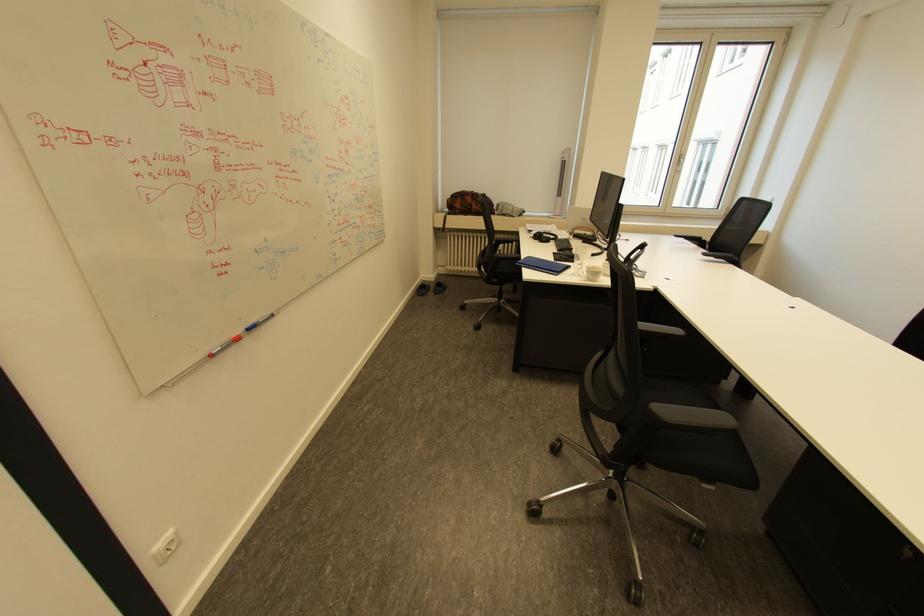
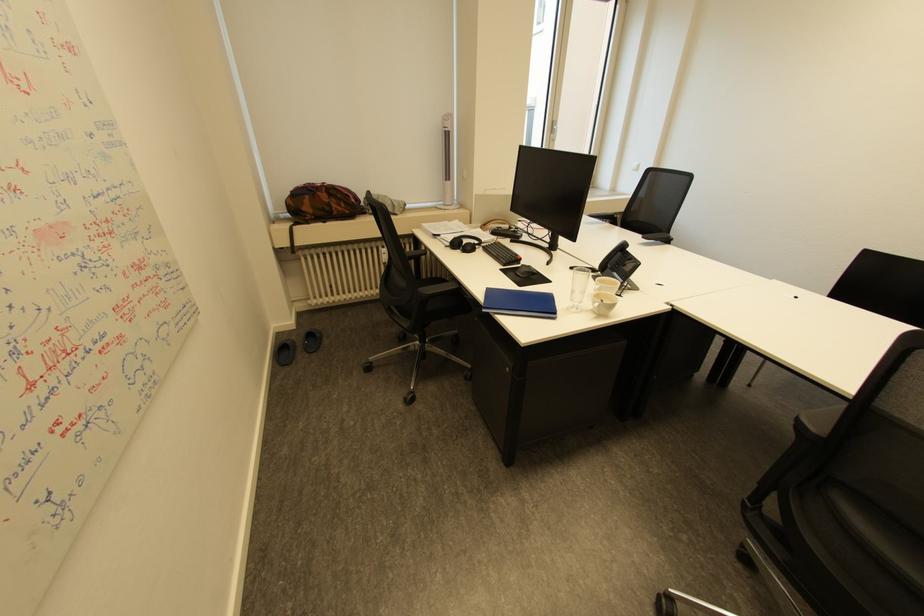
In the second image, find the point that corresponds to point (565, 237) in the first image.

(490, 240)